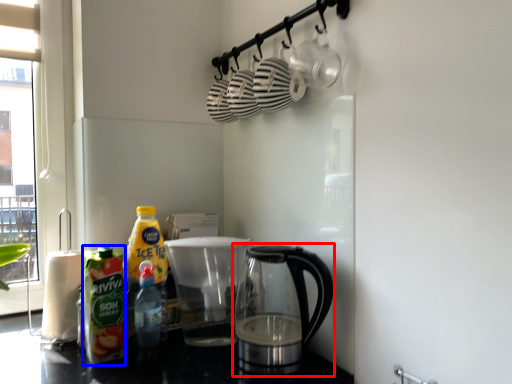
Question: Which object is closer to the camera taking this photo, kettle (highlighted by a red box) or bottle (highlighted by a blue box)?

Choices:
 (A) kettle
 (B) bottle

Answer: (A)